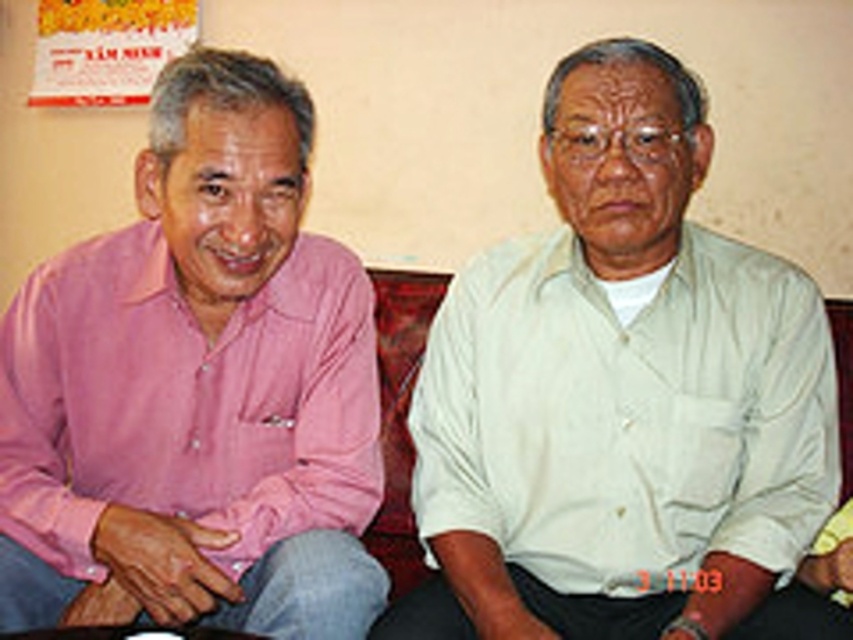
You are standing in front of the two people seated against the wall. You want to place a small gift box exactly at the point marked as point (374, 362). If you are 1.62 meters away from this point, can you comfortably reach it without moving your feet?

The point (374, 362) is 1.62 meters away from you. Since the average comfortable reaching distance for most adults is about 1 meter, you would not be able to comfortably reach the point without moving your feet.

You are a photographer setting up for a portrait. You need to position a light source to the left of the pink cotton shirt at left and to the right of the light beige cotton shirt at right. Is this possible given their positions?

The pink cotton shirt at left is to the left of the light beige cotton shirt at right. Therefore, placing the light source to the left of the pink cotton shirt at left would also place it to the left of the light beige cotton shirt at right, making it impossible to have the light to the right of the light beige cotton shirt at right simultaneously. This setup isn

You are standing in front of the image and want to locate the pink cotton shirt at left. Where exactly is it positioned in terms of coordinates?

The pink cotton shirt at left is located at point coordinates of 0.605 on the x axis and 0.233 on the y axis.